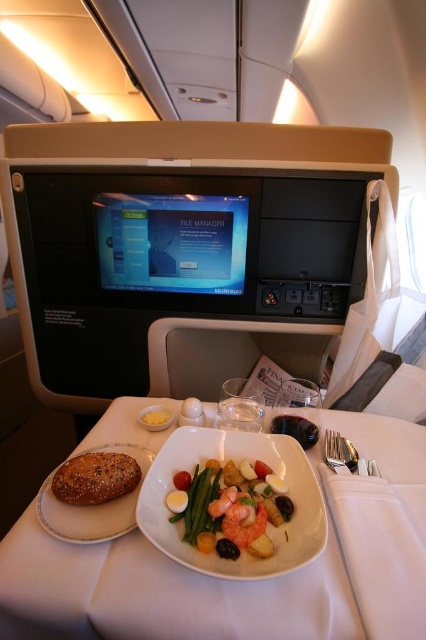
Question: Among these objects, which one is nearest to the camera?

Choices:
 (A) shiny silver plate at center
 (B) white matte plate at left
 (C) silver metallic fork at right

Answer: (A)

Question: Which of the following is the farthest from the observer?

Choices:
 (A) white glossy plate at center
 (B) silver metallic fork at right
 (C) white matte plate at left
 (D) shiny silver plate at center

Answer: (B)

Question: Does shiny silver plate at center have a greater width compared to white matte plate at left?

Choices:
 (A) yes
 (B) no

Answer: (B)

Question: Is shiny silver plate at center to the right of white matte plate at left from the viewer's perspective?

Choices:
 (A) no
 (B) yes

Answer: (B)

Question: Does white glossy plate at center have a greater width compared to yellow matte bread at left?

Choices:
 (A) no
 (B) yes

Answer: (B)

Question: Which point is closer to the camera?

Choices:
 (A) click(43, 595)
 (B) click(207, 474)

Answer: (A)